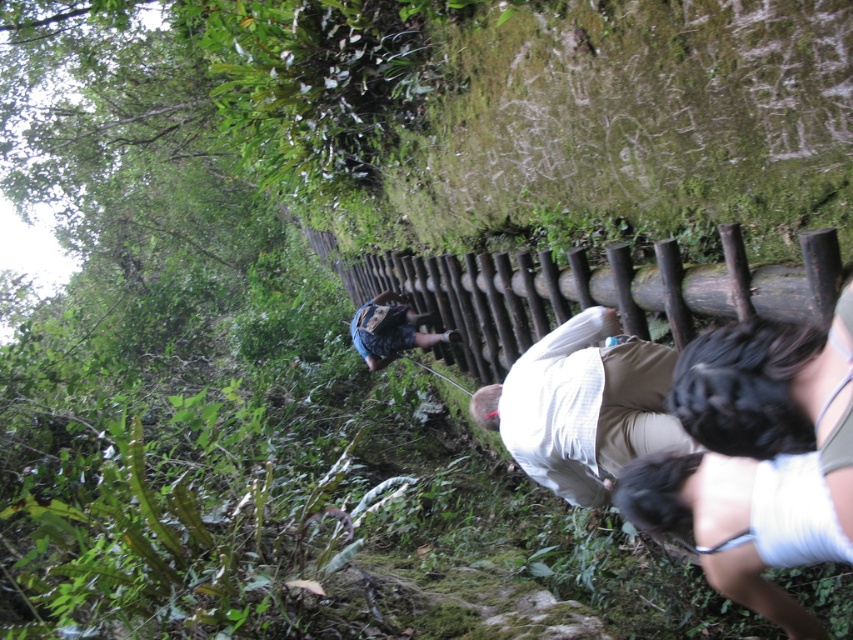
Question: Among these points, which one is farthest from the camera?

Choices:
 (A) (733, 260)
 (B) (712, 360)
 (C) (372, 320)

Answer: (C)

Question: Which point is farther to the camera?

Choices:
 (A) (537, 362)
 (B) (653, 289)
 (C) (358, 308)

Answer: (C)

Question: Which point appears farthest from the camera in this image?

Choices:
 (A) (695, 307)
 (B) (431, 339)

Answer: (B)

Question: Can you confirm if brown wooden fence at center is positioned to the right of white cotton shirt at center?

Choices:
 (A) no
 (B) yes

Answer: (B)

Question: Observing the image, what is the correct spatial positioning of brown wooden fence at center in reference to white cotton shirt at center?

Choices:
 (A) above
 (B) below

Answer: (A)

Question: Does dark brown hair at lower right lie in front of blue denim shorts at center?

Choices:
 (A) no
 (B) yes

Answer: (B)